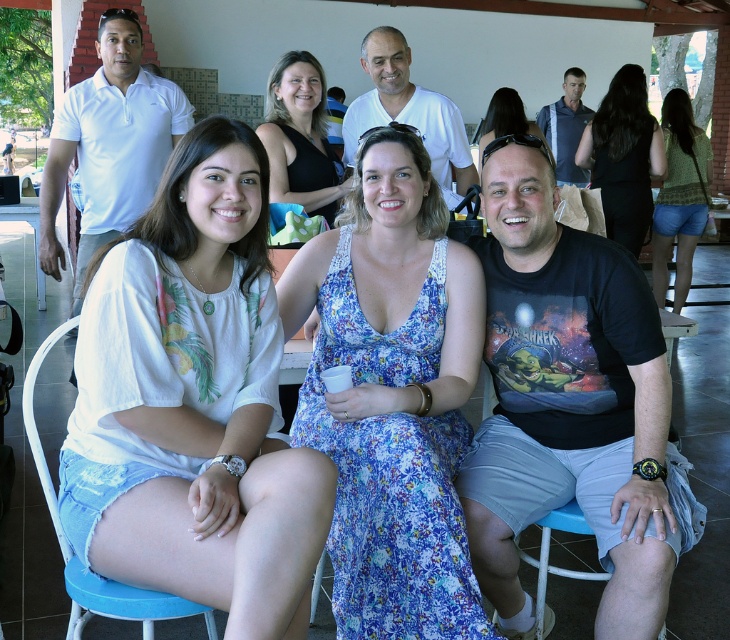
Which is more to the left, black dress at center or green textured blouse at right?

black dress at center is more to the left.

Is point (634, 172) positioned in front of point (677, 221)?

Yes, it is.

Which is in front, point (602, 124) or point (658, 193)?

Positioned in front is point (602, 124).

Find the location of a particular element. The width and height of the screenshot is (730, 640). black dress at center is located at coordinates (623, 156).

Does green textured blouse at right have a lesser height compared to matte black sunglasses at upper center?

No.

Can you confirm if green textured blouse at right is smaller than matte black sunglasses at upper center?

Incorrect, green textured blouse at right is not smaller in size than matte black sunglasses at upper center.

Where is `green textured blouse at right`? green textured blouse at right is located at coordinates (680, 196).

Is white cotton shirt at center closer to camera compared to green textured blouse at right?

Yes, white cotton shirt at center is in front of green textured blouse at right.

Which is behind, point (288, 604) or point (669, 177)?

Point (669, 177)

Where is `white cotton shirt at center`? The image size is (730, 640). white cotton shirt at center is located at coordinates (195, 401).

Where is `white cotton shirt at center`? The height and width of the screenshot is (640, 730). white cotton shirt at center is located at coordinates [x=195, y=401].